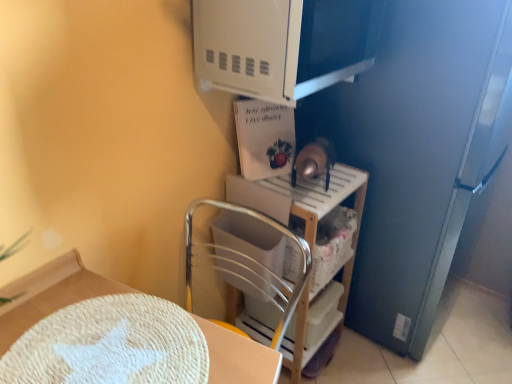
At what (x,y) coordinates should I click in order to perform the action: click on empty space that is ontop of wooden shelf at center. Please return your answer as a coordinate pair (x, y). The width and height of the screenshot is (512, 384). Looking at the image, I should click on (307, 183).